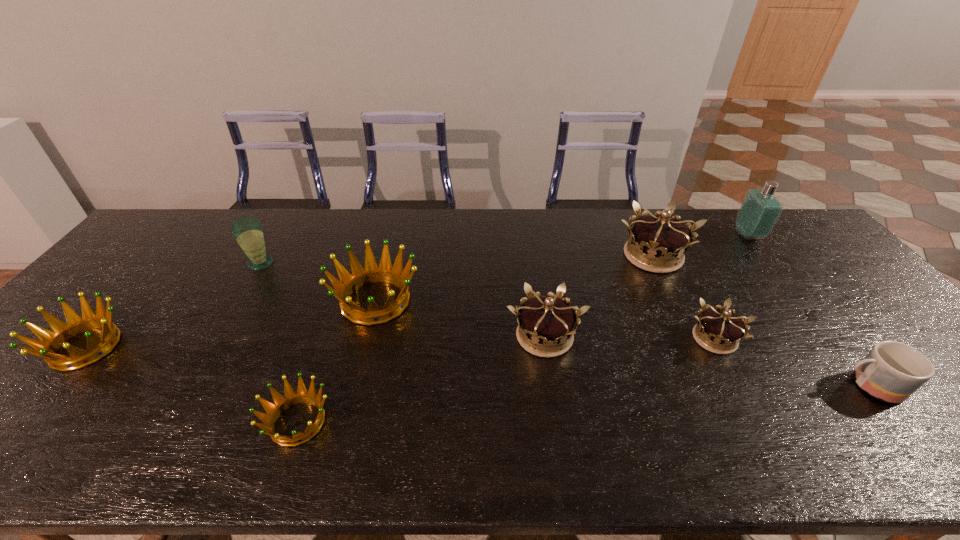
Locate which golden crown is the closest to the leftmost gold crown. Please provide its 2D coordinates. Your answer should be formatted as a tuple, i.e. [(x, y)], where the tuple contains the x and y coordinates of a point satisfying the conditions above.

[(371, 273)]

Find the location of a particular element. The width and height of the screenshot is (960, 540). golden crown that is the third nearest to the perfume is located at coordinates (51, 341).

The image size is (960, 540). I want to click on free location that satisfies the following two spatial constraints: 1. on the front side of the fifth object from left to right; 2. on the right side of the smallest gold crown, so click(x=545, y=339).

Where is `vacant area in the image that satisfies the following two spatial constraints: 1. on the front side of the glass; 2. on the right side of the fourth crown from left to right`? The height and width of the screenshot is (540, 960). vacant area in the image that satisfies the following two spatial constraints: 1. on the front side of the glass; 2. on the right side of the fourth crown from left to right is located at coordinates (218, 336).

Identify the location of vacant position in the image that satisfies the following two spatial constraints: 1. on the back side of the eighth object from right to left; 2. on the left side of the biggest gold crown. This screenshot has width=960, height=540. (266, 255).